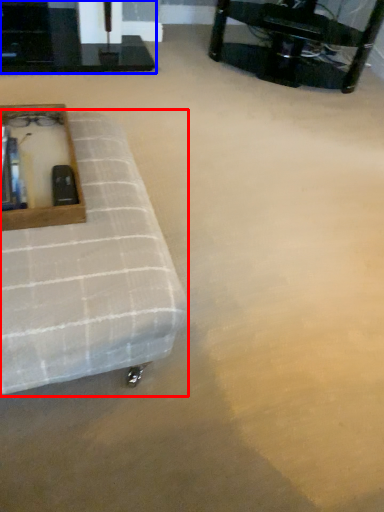
Question: Among these objects, which one is farthest to the camera, furniture (highlighted by a red box) or table (highlighted by a blue box)?

Choices:
 (A) furniture
 (B) table

Answer: (B)